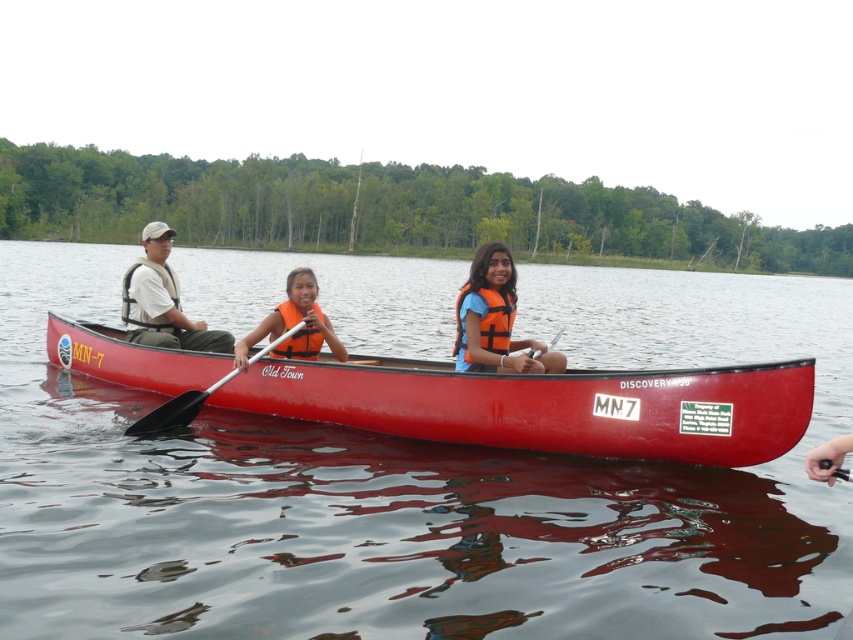
Question: Can you confirm if transparent water at center is bigger than matte red canoe at center?

Choices:
 (A) yes
 (B) no

Answer: (A)

Question: Among these objects, which one is farthest from the camera?

Choices:
 (A) metallic silver paddle at center
 (B) matte red canoe at center

Answer: (B)

Question: Which object is farther from the camera taking this photo?

Choices:
 (A) metallic silver paddle at center
 (B) orange life vest at center

Answer: (A)

Question: Which of these objects is positioned farthest from the metallic silver paddle at center?

Choices:
 (A) matte red canoe at center
 (B) transparent water at center
 (C) matte white life vest at left

Answer: (B)

Question: Can you confirm if transparent water at center is positioned above metallic silver paddle at center?

Choices:
 (A) no
 (B) yes

Answer: (B)

Question: From the image, what is the correct spatial relationship of matte red canoe at center in relation to metallic silver paddle at center?

Choices:
 (A) right
 (B) left

Answer: (A)